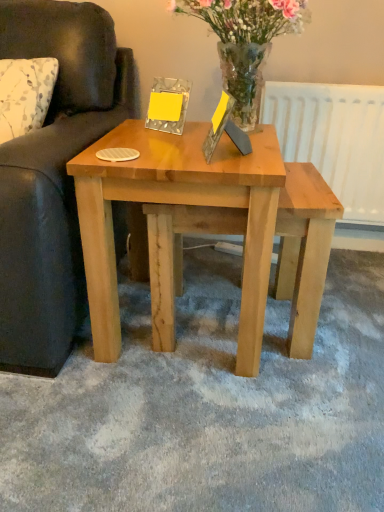
Question: Visually, is wooden picture frame at center positioned to the left or to the right of white matte radiator at upper right?

Choices:
 (A) right
 (B) left

Answer: (B)

Question: Would you say wooden picture frame at center is inside or outside white matte radiator at upper right?

Choices:
 (A) inside
 (B) outside

Answer: (B)

Question: Which of these objects is positioned closest to the natural wood coffee table at center?

Choices:
 (A) dark brown leather couch at left
 (B) wooden picture frame at center
 (C) white matte radiator at upper right
 (D) translucent glass vase at upper center

Answer: (B)

Question: Which of these objects is positioned closest to the dark brown leather couch at left?

Choices:
 (A) white matte radiator at upper right
 (B) natural wood coffee table at center
 (C) wooden picture frame at center
 (D) translucent glass vase at upper center

Answer: (B)